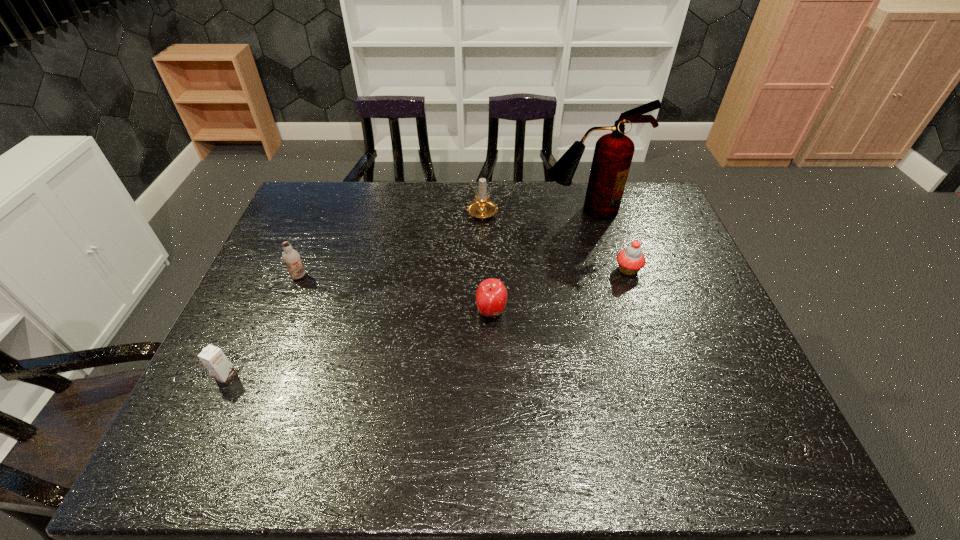
You are a GUI agent. You are given a task and a screenshot of the screen. Output one action in this format:
    pyautogui.click(x=<x>, y=<y>)
    Task: Click on the vacant space positioned on the front of the second object from left to right
    
    Given the screenshot: What is the action you would take?
    (x=291, y=295)

This screenshot has width=960, height=540. I want to click on blank space located on the back of the apple, so [489, 214].

I want to click on free space located 0.190m on the front of the cupcake, so click(x=650, y=333).

This screenshot has height=540, width=960. Identify the location of free space located 0.080m on the right of the shorter chocolate milk. (270, 376).

The height and width of the screenshot is (540, 960). Find the location of `fire extinguisher that is at the far edge`. fire extinguisher that is at the far edge is located at coordinates (613, 153).

This screenshot has width=960, height=540. What are the coordinates of `candle that is at the far edge` in the screenshot? It's located at (482, 208).

This screenshot has width=960, height=540. Identify the location of fire extinguisher at the right edge. (613, 153).

The height and width of the screenshot is (540, 960). In order to click on cupcake that is at the right edge in this screenshot , I will do pyautogui.click(x=631, y=260).

Locate an element on the screen. This screenshot has width=960, height=540. object at the far right corner is located at coordinates (613, 153).

At what (x,y) coordinates should I click in order to perform the action: click on vacant region at the far edge of the desktop. Please return your answer as a coordinate pair (x, y). This screenshot has height=540, width=960. Looking at the image, I should click on (420, 217).